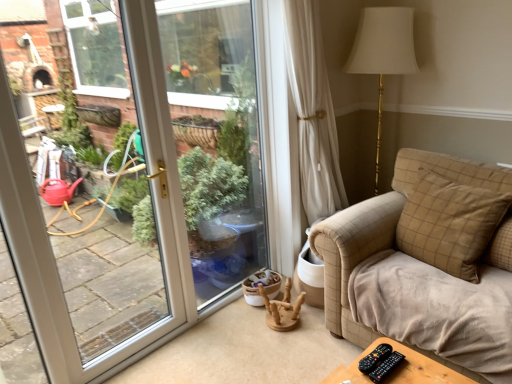
Where is `free spot to the left of wooden at center`? free spot to the left of wooden at center is located at coordinates (241, 326).